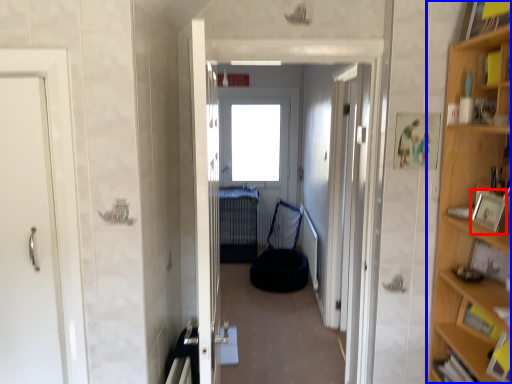
Question: Which of the following is the farthest to the observer, picture frame (highlighted by a red box) or cabinetry (highlighted by a blue box)?

Choices:
 (A) picture frame
 (B) cabinetry

Answer: (A)